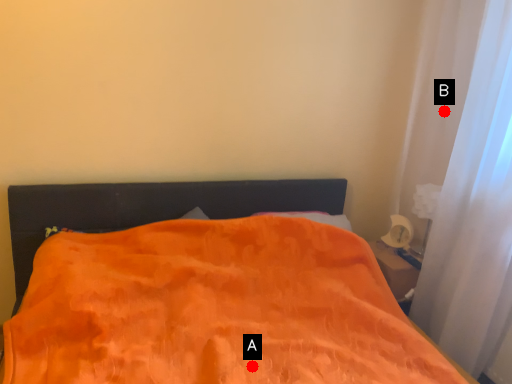
Question: Two points are circled on the image, labeled by A and B beside each circle. Which point is farther to the camera?

Choices:
 (A) A is further
 (B) B is further

Answer: (B)